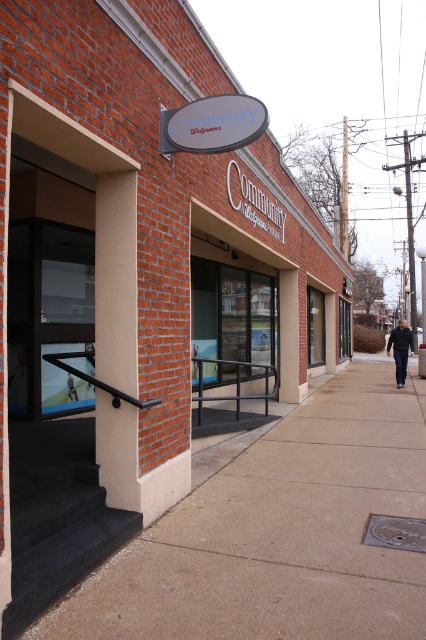
You are standing at the entrance of the Community Walgreens and want to check the condition of the sidewalk in front of the store. According to the image, what is the color and state of the sidewalk at the point specified as point [279,532]?

The brown concrete sidewalk at lower left at point [279,532] is slightly wet, as mentioned in the scene description, indicating recent rain or damp conditions.

You are standing in front of the Community Walgreens store and notice the brown concrete sidewalk at lower left and the dark blue jeans at center. Which object is taller?

The dark blue jeans at center are taller than the brown concrete sidewalk at lower left.

Consider the image. You are a delivery person trying to park your bike on the brown concrete sidewalk at lower left. The bike requires a space wider than the dark blue jeans at center. Can you park your bike there?

The brown concrete sidewalk at lower left is narrower than the dark blue jeans at center, so it is not wide enough to accommodate the bike that requires a space wider than the dark blue jeans at center.